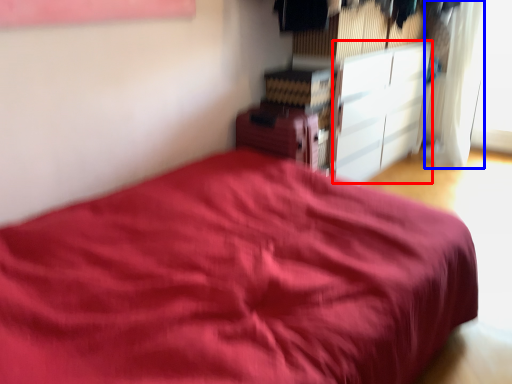
Question: Which object appears farthest to the camera in this image, cabinetry (highlighted by a red box) or curtain (highlighted by a blue box)?

Choices:
 (A) cabinetry
 (B) curtain

Answer: (B)